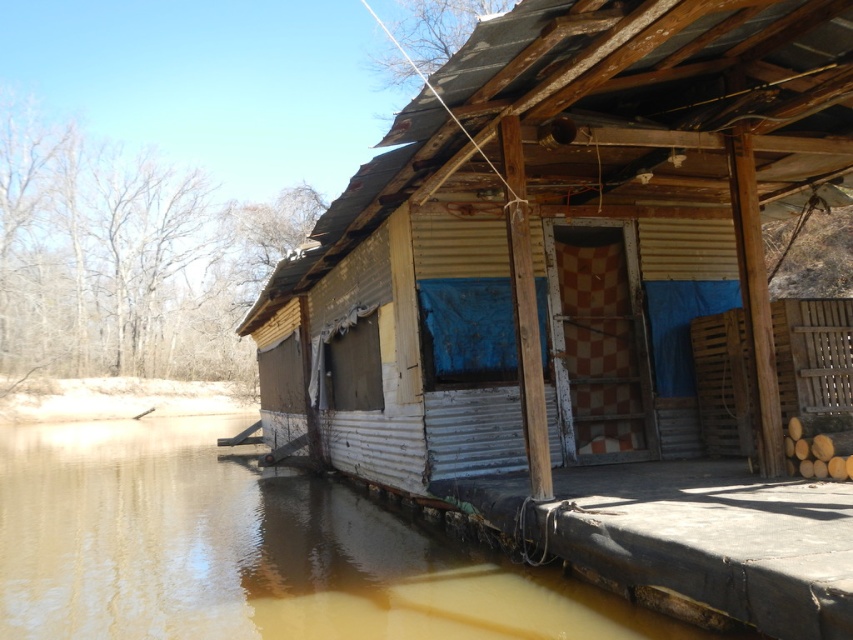
Who is more forward, (x=775, y=451) or (x=422, y=532)?

Point (x=775, y=451) is more forward.

Is yellow corrugated metal hut at center closer to the viewer compared to brown murky water at lower left?

Yes, it is.

Which is behind, point (492, 20) or point (374, 634)?

The point (374, 634) is behind.

Find the location of `yellow corrugated metal hut at center`. yellow corrugated metal hut at center is located at coordinates (593, 301).